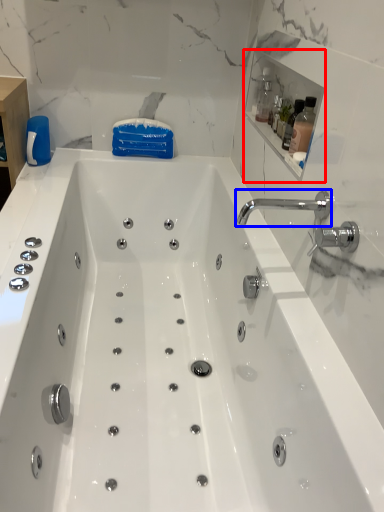
Question: Among these objects, which one is nearest to the camera, medicine cabinet (highlighted by a red box) or tap (highlighted by a blue box)?

Choices:
 (A) medicine cabinet
 (B) tap

Answer: (B)